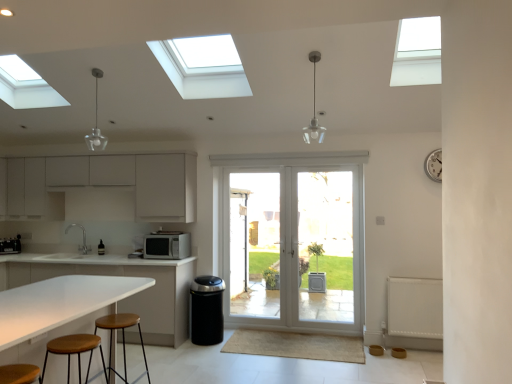
Question: Considering their positions, is white matte microwave at center, placed as the 2th appliance when sorted from back to front, located in front of or behind white metallic clock at upper right?

Choices:
 (A) front
 (B) behind

Answer: (B)

Question: From the image's perspective, is white matte microwave at center, the 1th appliance when ordered from right to left, above or below white metallic clock at upper right?

Choices:
 (A) above
 (B) below

Answer: (B)

Question: Which object is positioned farthest from the clear glass door at center?

Choices:
 (A) white matte microwave at center, the second appliance when ordered from left to right
 (B) white laminate table at lower left
 (C) satin nickel faucet at center
 (D) brown wood stool at lower left, arranged as the 2th stool when viewed from the back
 (E) white textured radiator at lower right

Answer: (D)

Question: Which is farther from the white matte countertop at left, arranged as the second cabinetry when viewed from the top?

Choices:
 (A) white laminate table at lower left
 (B) white matte microwave at center, the second appliance when ordered from left to right
 (C) brown wood stool at lower left, which ranks as the 1th stool in front-to-back order
 (D) clear glass door at center
 (E) white matte cabinets at left, acting as the second cabinetry starting from the bottom

Answer: (C)